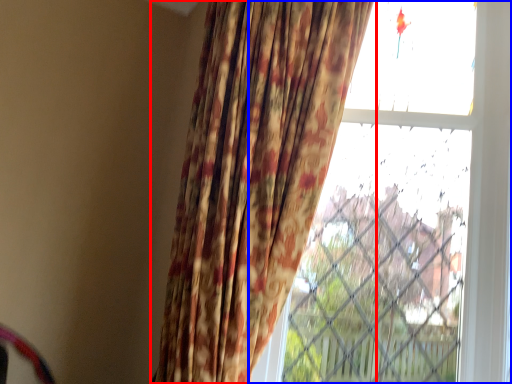
Question: Which point is closer to the camera, curtain (highlighted by a red box) or window (highlighted by a blue box)?

Choices:
 (A) curtain
 (B) window

Answer: (A)